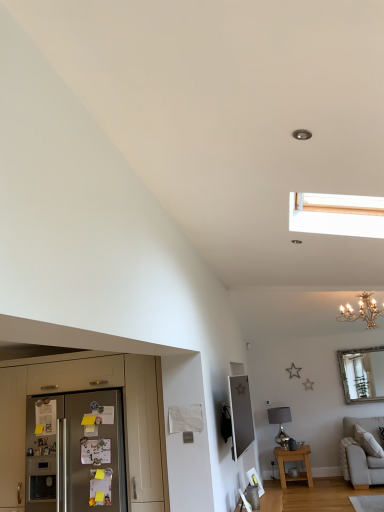
Question: Is satin silver refrigerator at lower left oriented towards beech wood side table at lower right?

Choices:
 (A) yes
 (B) no

Answer: (B)

Question: Is there a large distance between satin silver refrigerator at lower left and beech wood side table at lower right?

Choices:
 (A) no
 (B) yes

Answer: (B)

Question: Considering the relative sizes of satin silver refrigerator at lower left and beech wood side table at lower right in the image provided, is satin silver refrigerator at lower left shorter than beech wood side table at lower right?

Choices:
 (A) yes
 (B) no

Answer: (B)

Question: From the image's perspective, would you say satin silver refrigerator at lower left is shown under beech wood side table at lower right?

Choices:
 (A) yes
 (B) no

Answer: (B)

Question: Would you say satin silver refrigerator at lower left contains beech wood side table at lower right?

Choices:
 (A) yes
 (B) no

Answer: (B)

Question: In terms of width, does silver metallic mirror at upper right look wider or thinner when compared to beech wood side table at lower right?

Choices:
 (A) thin
 (B) wide

Answer: (A)

Question: Is silver metallic mirror at upper right situated inside beech wood side table at lower right or outside?

Choices:
 (A) inside
 (B) outside

Answer: (B)

Question: From a real-world perspective, relative to beech wood side table at lower right, is silver metallic mirror at upper right vertically above or below?

Choices:
 (A) below
 (B) above

Answer: (B)

Question: Considering the positions of silver metallic mirror at upper right and beech wood side table at lower right in the image, is silver metallic mirror at upper right taller or shorter than beech wood side table at lower right?

Choices:
 (A) short
 (B) tall

Answer: (B)

Question: Relative to satin silver refrigerator at lower left, is silver metallic mirror at upper right in front or behind?

Choices:
 (A) front
 (B) behind

Answer: (B)

Question: Is point (377, 384) positioned closer to the camera than point (76, 434)?

Choices:
 (A) farther
 (B) closer

Answer: (A)

Question: From a real-world perspective, is silver metallic mirror at upper right positioned above or below satin silver refrigerator at lower left?

Choices:
 (A) below
 (B) above

Answer: (B)

Question: In terms of size, does silver metallic mirror at upper right appear bigger or smaller than satin silver refrigerator at lower left?

Choices:
 (A) big
 (B) small

Answer: (B)

Question: From a real-world perspective, is beech wood side table at lower right above or below silver metallic mirror at upper right?

Choices:
 (A) below
 (B) above

Answer: (A)

Question: Would you say beech wood side table at lower right is inside or outside silver metallic mirror at upper right?

Choices:
 (A) outside
 (B) inside

Answer: (A)